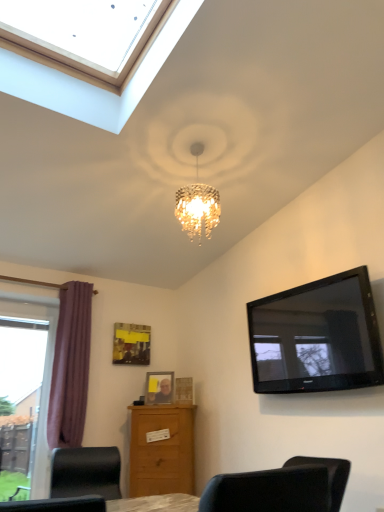
Question: From the image's perspective, is purple fabric curtain at left on wooden photo frame at center, acting as the 1th picture frame starting from the right?

Choices:
 (A) no
 (B) yes

Answer: (B)

Question: Is purple fabric curtain at left wider than wooden photo frame at center, acting as the 1th picture frame starting from the right?

Choices:
 (A) no
 (B) yes

Answer: (B)

Question: From the image's perspective, would you say purple fabric curtain at left is shown under wooden photo frame at center, the third picture frame viewed from the left?

Choices:
 (A) yes
 (B) no

Answer: (B)

Question: From a real-world perspective, is purple fabric curtain at left under wooden photo frame at center, the third picture frame viewed from the left?

Choices:
 (A) yes
 (B) no

Answer: (B)

Question: Can you confirm if purple fabric curtain at left is thinner than wooden photo frame at center, the third picture frame viewed from the left?

Choices:
 (A) yes
 (B) no

Answer: (B)

Question: Is purple fabric curtain at left closer to the viewer compared to wooden photo frame at center, the third picture frame viewed from the left?

Choices:
 (A) yes
 (B) no

Answer: (A)

Question: Is black glossy tv at upper right at the right side of wooden chest of drawers at lower center?

Choices:
 (A) yes
 (B) no

Answer: (A)

Question: From the image's perspective, does black glossy tv at upper right appear higher than wooden chest of drawers at lower center?

Choices:
 (A) yes
 (B) no

Answer: (A)

Question: Can you confirm if black glossy tv at upper right is thinner than wooden chest of drawers at lower center?

Choices:
 (A) no
 (B) yes

Answer: (B)

Question: From the image's perspective, does black glossy tv at upper right appear lower than wooden chest of drawers at lower center?

Choices:
 (A) no
 (B) yes

Answer: (A)

Question: Is wooden chest of drawers at lower center located within black glossy tv at upper right?

Choices:
 (A) yes
 (B) no

Answer: (B)

Question: Is black glossy tv at upper right facing towards wooden chest of drawers at lower center?

Choices:
 (A) no
 (B) yes

Answer: (A)

Question: Is purple fabric curtain at left surrounded by wooden chest of drawers at lower center?

Choices:
 (A) yes
 (B) no

Answer: (B)